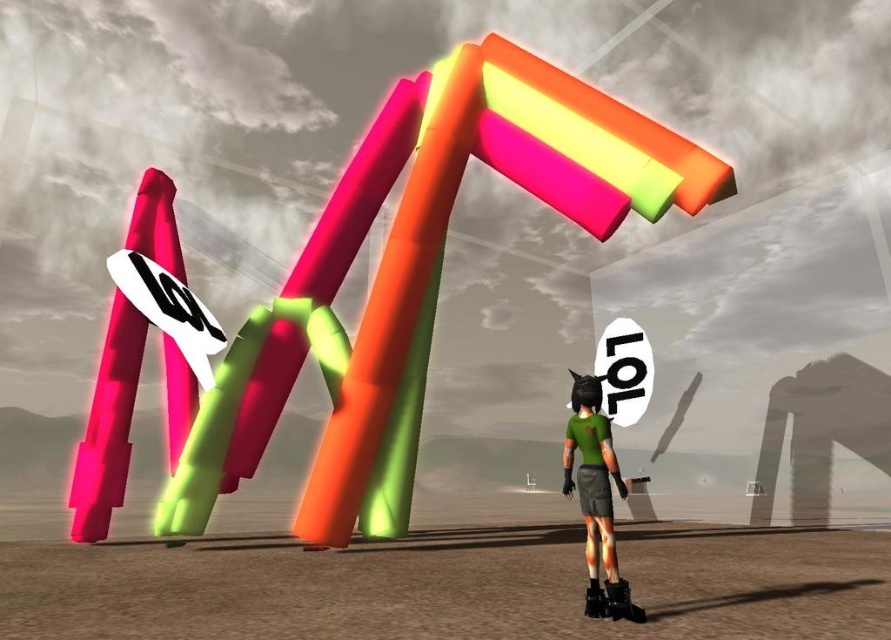
Which is below, neon plastic sign at center or green matte shirt at center?

Positioned lower is green matte shirt at center.

Can you confirm if neon plastic sign at center is taller than green matte shirt at center?

Correct, neon plastic sign at center is much taller as green matte shirt at center.

Where is `neon plastic sign at center`? neon plastic sign at center is located at coordinates (289, 324).

Can you confirm if neon plastic letters at center is positioned above green matte shirt at center?

Yes.

Does neon plastic letters at center have a greater width compared to green matte shirt at center?

Yes, neon plastic letters at center is wider than green matte shirt at center.

Which is behind, point (348, 483) or point (597, 563)?

The point (348, 483) is behind.

Locate an element on the screen. This screenshot has height=640, width=891. neon plastic letters at center is located at coordinates (444, 240).

Does matte pink pole at left appear over green matte shirt at center?

Yes.

Does matte pink pole at left appear under green matte shirt at center?

No, matte pink pole at left is not below green matte shirt at center.

Does point (86, 458) lie behind point (627, 592)?

Yes, point (86, 458) is farther from viewer.

The width and height of the screenshot is (891, 640). In order to click on matte pink pole at left in this screenshot , I will do `click(107, 426)`.